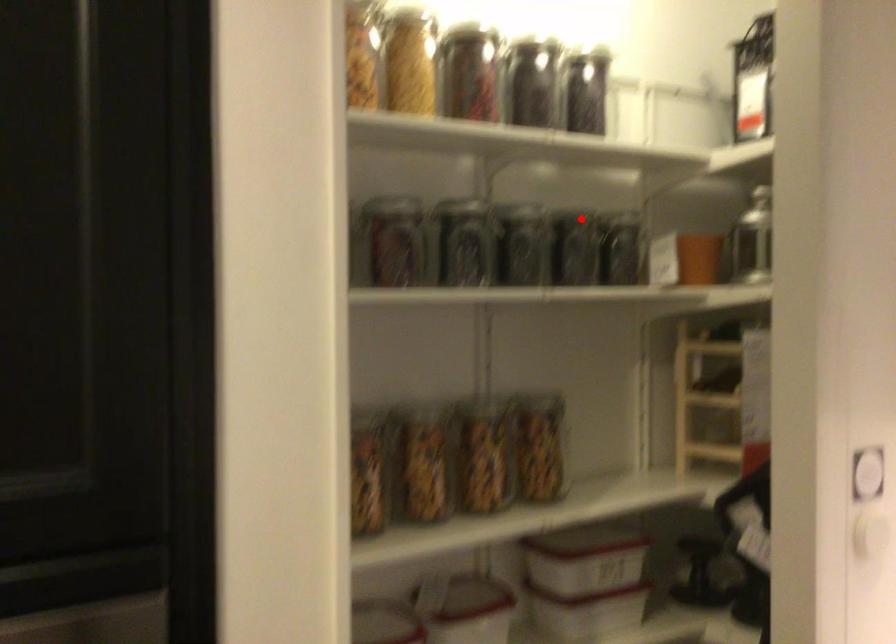
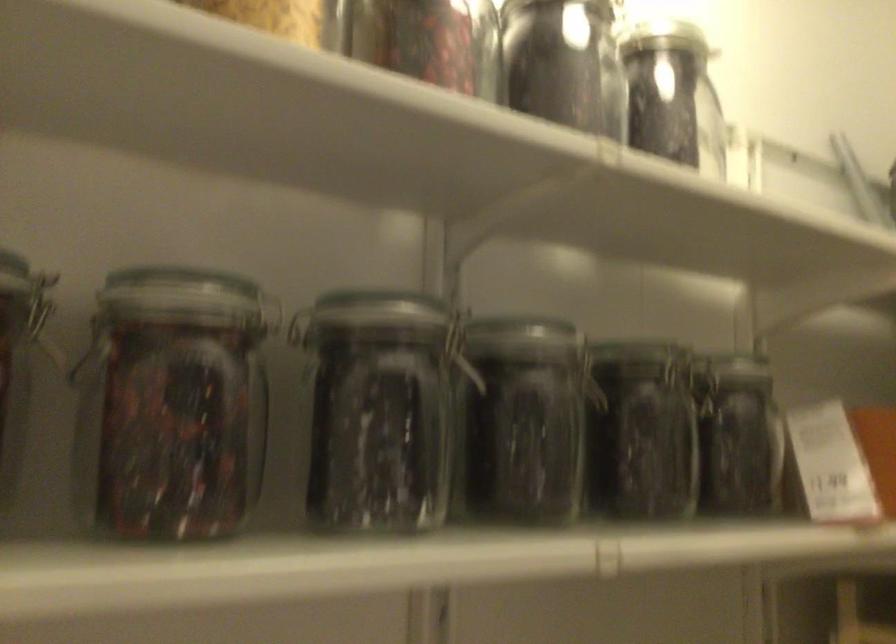
The point at the highlighted location is marked in the first image. Where is the corresponding point in the second image?

(652, 361)